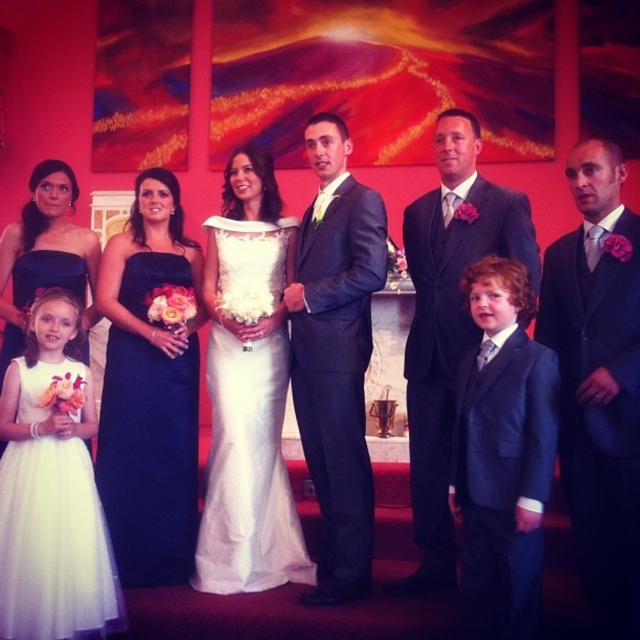
Is point (588, 275) farther from camera compared to point (8, 257)?

No, it is not.

Does black satin suit at center lie behind matte navy blue dress at left?

That is False.

Identify the location of black satin suit at center. (598, 380).

You are a GUI agent. You are given a task and a screenshot of the screen. Output one action in this format:
    pyautogui.click(x=<x>, y=<y>)
    Task: Click on the black satin suit at center
    The image size is (640, 640).
    Given the screenshot: What is the action you would take?
    pyautogui.click(x=598, y=380)

Is matte black suit at center taller than white tulle dress at lower left?

Indeed, matte black suit at center has a greater height compared to white tulle dress at lower left.

Can you confirm if matte black suit at center is smaller than white tulle dress at lower left?

No.

Locate an element on the screen. The height and width of the screenshot is (640, 640). matte black suit at center is located at coordinates (449, 324).

Who is more forward, (572, 298) or (339, 429)?

Point (572, 298) is more forward.

Between black satin suit at center and dark gray suit at center, which one has less height?

black satin suit at center is shorter.

Find the location of `black satin suit at center`. black satin suit at center is located at coordinates pos(598,380).